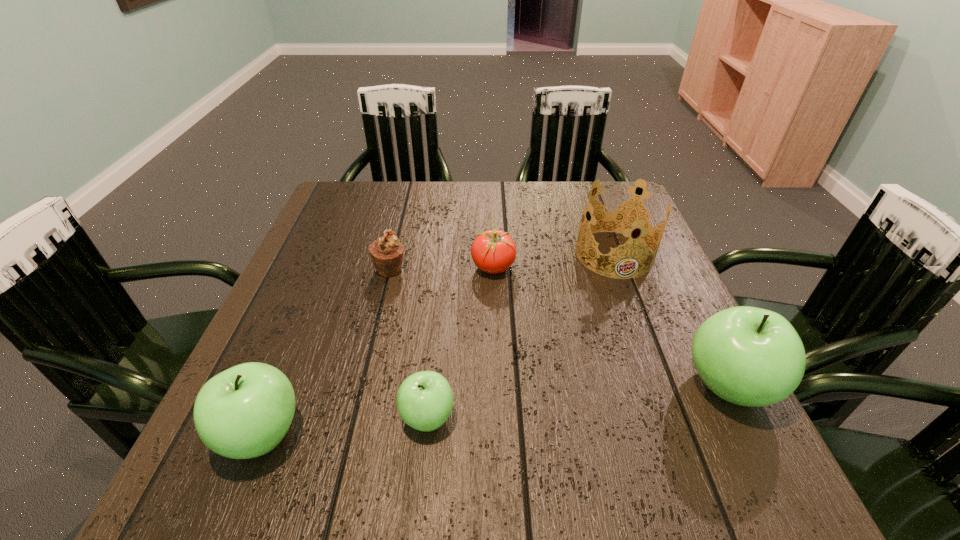
The width and height of the screenshot is (960, 540). In the image, there is a desktop. Identify the location of vacant space at the near edge. (543, 415).

In the image, there is a desktop. What are the coordinates of `vacant space at the left edge` in the screenshot? It's located at (316, 354).

Find the location of a particular element. This screenshot has width=960, height=540. vacant space at the right edge of the desktop is located at coordinates (708, 388).

The height and width of the screenshot is (540, 960). I want to click on vacant space at the far left corner of the desktop, so click(x=381, y=194).

The width and height of the screenshot is (960, 540). I want to click on vacant space at the far right corner, so pyautogui.click(x=582, y=208).

Where is `unoccupied area between the leftmost apple and the rightmost apple`? Image resolution: width=960 pixels, height=540 pixels. unoccupied area between the leftmost apple and the rightmost apple is located at coordinates (495, 410).

At what (x,y) coordinates should I click in order to perform the action: click on free space between the tomato and the rightmost apple. Please return your answer as a coordinate pair (x, y). This screenshot has height=540, width=960. Looking at the image, I should click on (611, 327).

Where is `free space between the fourth object from right to left and the muffin`? The image size is (960, 540). free space between the fourth object from right to left and the muffin is located at coordinates (409, 343).

Where is `free area in between the rightmost apple and the shortest apple`? free area in between the rightmost apple and the shortest apple is located at coordinates (578, 402).

Where is `empty space between the tomato and the rightmost apple`? empty space between the tomato and the rightmost apple is located at coordinates (611, 327).